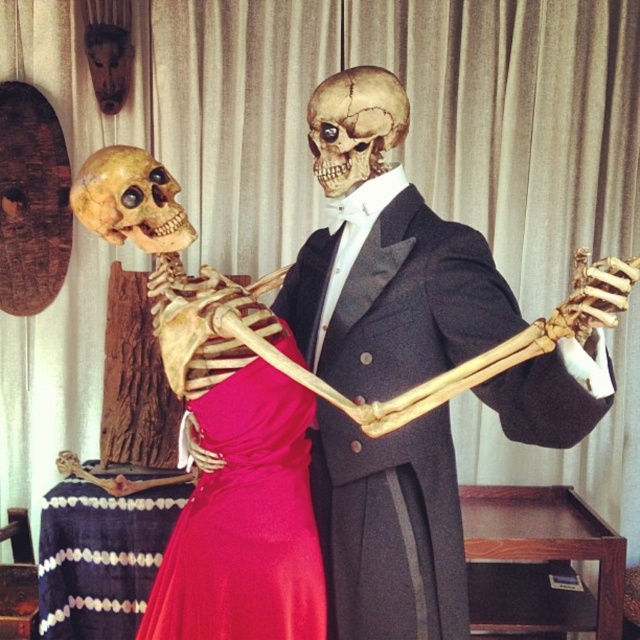
You are a photographer standing in front of the smooth beige skull at center. You want to take a closeup shot of it. If your camera can focus on objects within 1 meter, will you need to move closer or farther away?

The smooth beige skull at center is 1.51 meters away from you. Since your camera can focus within 1 meter, you need to move closer to the smooth beige skull at center to get a clear closeup.

Looking at this image, you are a photographer setting up a shoot in the scene described. You need to place a small prop exactly at point (x=392, y=292). What object will the prop be placed on top of?

The prop will be placed on top of the matte pink dress at center located at point (x=392, y=292).

You are a fashion designer examining the skeletons in formal attire. You need to determine which object is taller between the shiny red fabric dress at center and the smooth beige skull at center. Which one is taller?

The shiny red fabric dress at center is taller than the smooth beige skull at center according to the description.